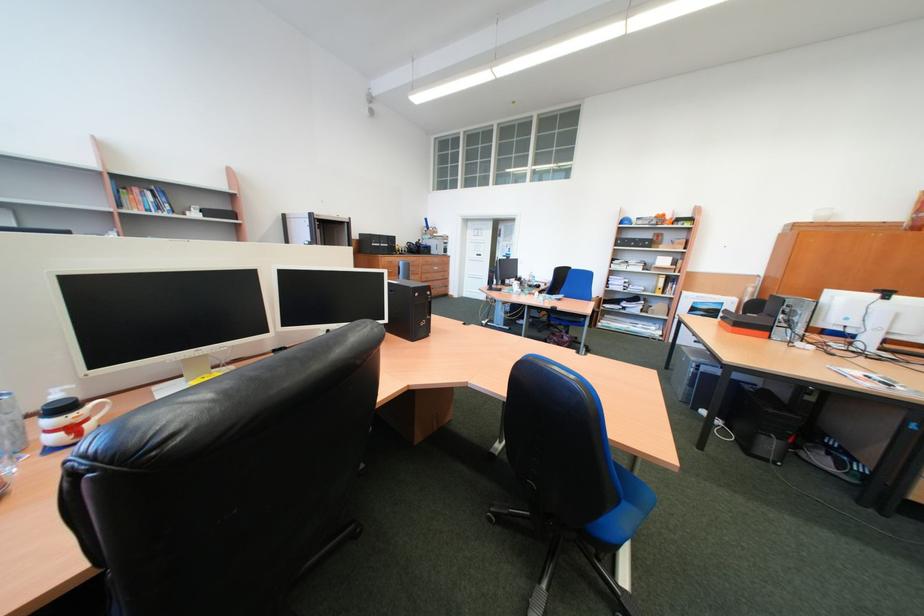
Describe the element at coordinates (625, 220) in the screenshot. The image size is (924, 616). I see `the blue safety helmet` at that location.